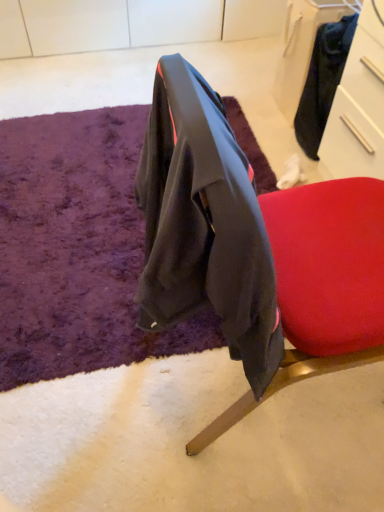
Measure the distance between purple shaggy rug at center and camera.

They are 3.73 feet apart.

Describe the element at coordinates (254, 249) in the screenshot. I see `velvet-like black jacket at center` at that location.

What do you see at coordinates (359, 104) in the screenshot?
I see `black fabric drawer at upper right` at bounding box center [359, 104].

Locate an element on the screen. The width and height of the screenshot is (384, 512). purple shaggy rug at center is located at coordinates (76, 249).

From a real-world perspective, which is physically below, purple shaggy rug at center or velvet-like black jacket at center?

purple shaggy rug at center.

Would you say purple shaggy rug at center is inside or outside velvet-like black jacket at center?

purple shaggy rug at center lies outside velvet-like black jacket at center.

Considering the positions of objects purple shaggy rug at center and velvet-like black jacket at center in the image provided, who is more to the right, purple shaggy rug at center or velvet-like black jacket at center?

velvet-like black jacket at center is more to the right.

Is purple shaggy rug at center positioned in front of velvet-like black jacket at center?

No, the depth of purple shaggy rug at center is greater than that of velvet-like black jacket at center.

In terms of height, does black fabric drawer at upper right look taller or shorter compared to velvet-like black jacket at center?

Clearly, black fabric drawer at upper right is shorter compared to velvet-like black jacket at center.

Is velvet-like black jacket at center surrounded by black fabric drawer at upper right?

No.

Is black fabric drawer at upper right at the right side of velvet-like black jacket at center?

Yes, black fabric drawer at upper right is to the right of velvet-like black jacket at center.

Is purple shaggy rug at center looking in the opposite direction of black fabric drawer at upper right?

No, purple shaggy rug at center is not facing the opposite direction of black fabric drawer at upper right.

From the image's perspective, which one is positioned lower, purple shaggy rug at center or black fabric drawer at upper right?

purple shaggy rug at center, from the image's perspective.

Relative to black fabric drawer at upper right, is purple shaggy rug at center in front or behind?

Clearly, purple shaggy rug at center is in front of black fabric drawer at upper right.

Does purple shaggy rug at center have a greater height compared to black fabric drawer at upper right?

Incorrect, the height of purple shaggy rug at center is not larger of that of black fabric drawer at upper right.

From a real-world perspective, which object stands above the other?

velvet-like black jacket at center, from a real-world perspective.

From the image's perspective, is velvet-like black jacket at center above black fabric drawer at upper right?

No, from the image's perspective, velvet-like black jacket at center is not on top of black fabric drawer at upper right.

Considering the positions of objects velvet-like black jacket at center and black fabric drawer at upper right in the image provided, who is more to the right, velvet-like black jacket at center or black fabric drawer at upper right?

black fabric drawer at upper right.

Is black fabric drawer at upper right surrounding purple shaggy rug at center?

No.

From a real-world perspective, is black fabric drawer at upper right physically located above or below purple shaggy rug at center?

From a real-world perspective, black fabric drawer at upper right is physically above purple shaggy rug at center.

From the image's perspective, which is above, black fabric drawer at upper right or purple shaggy rug at center?

black fabric drawer at upper right, from the image's perspective.

Is point (294, 357) farther from camera compared to point (66, 148)?

No, it is in front of (66, 148).

Does velvet-like black jacket at center come in front of purple shaggy rug at center?

Yes, it is.

Which object is wider, velvet-like black jacket at center or purple shaggy rug at center?

With larger width is purple shaggy rug at center.

Is velvet-like black jacket at center aimed at purple shaggy rug at center?

No, velvet-like black jacket at center does not turn towards purple shaggy rug at center.

The width and height of the screenshot is (384, 512). I want to click on chair lying in front of the purple shaggy rug at center, so click(x=254, y=249).

Where is `drawer below the velvet-like black jacket at center (from a real-world perspective)`? The height and width of the screenshot is (512, 384). drawer below the velvet-like black jacket at center (from a real-world perspective) is located at coordinates (359, 104).

Considering their positions, is velvet-like black jacket at center positioned further to purple shaggy rug at center than black fabric drawer at upper right?

black fabric drawer at upper right is further to purple shaggy rug at center.

Based on their spatial positions, is purple shaggy rug at center or black fabric drawer at upper right further from velvet-like black jacket at center?

black fabric drawer at upper right is positioned further to the anchor velvet-like black jacket at center.

Estimate the real-world distances between objects in this image. Which object is further from black fabric drawer at upper right, purple shaggy rug at center or velvet-like black jacket at center?

Based on the image, purple shaggy rug at center appears to be further to black fabric drawer at upper right.

Estimate the real-world distances between objects in this image. Which object is closer to black fabric drawer at upper right, velvet-like black jacket at center or purple shaggy rug at center?

The object closer to black fabric drawer at upper right is velvet-like black jacket at center.

Which object lies further to the anchor point purple shaggy rug at center, black fabric drawer at upper right or velvet-like black jacket at center?

Among the two, black fabric drawer at upper right is located further to purple shaggy rug at center.

Looking at the image, which one is located closer to velvet-like black jacket at center, black fabric drawer at upper right or purple shaggy rug at center?

purple shaggy rug at center.

Where is `mat located between velvet-like black jacket at center and black fabric drawer at upper right in the depth direction`? This screenshot has height=512, width=384. mat located between velvet-like black jacket at center and black fabric drawer at upper right in the depth direction is located at coordinates (76, 249).